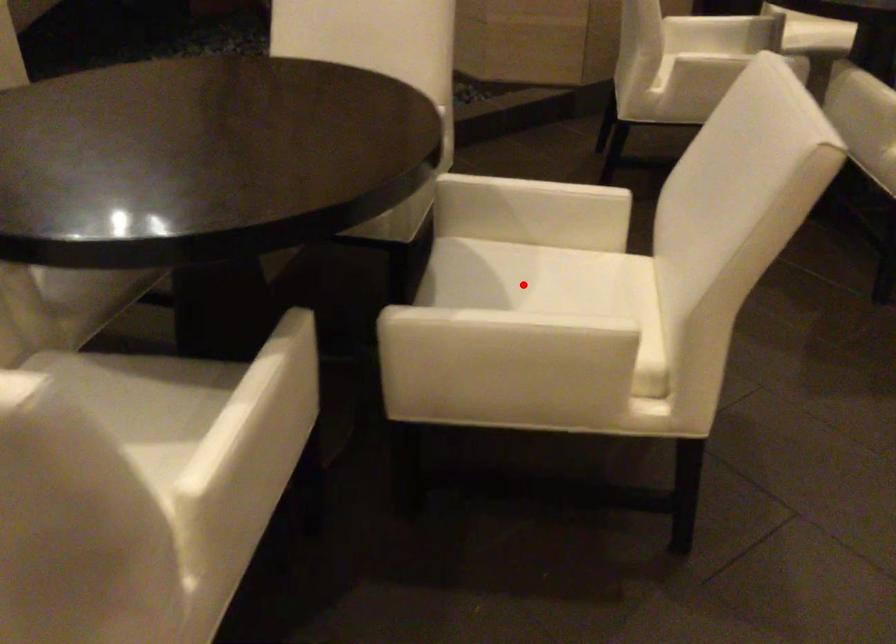
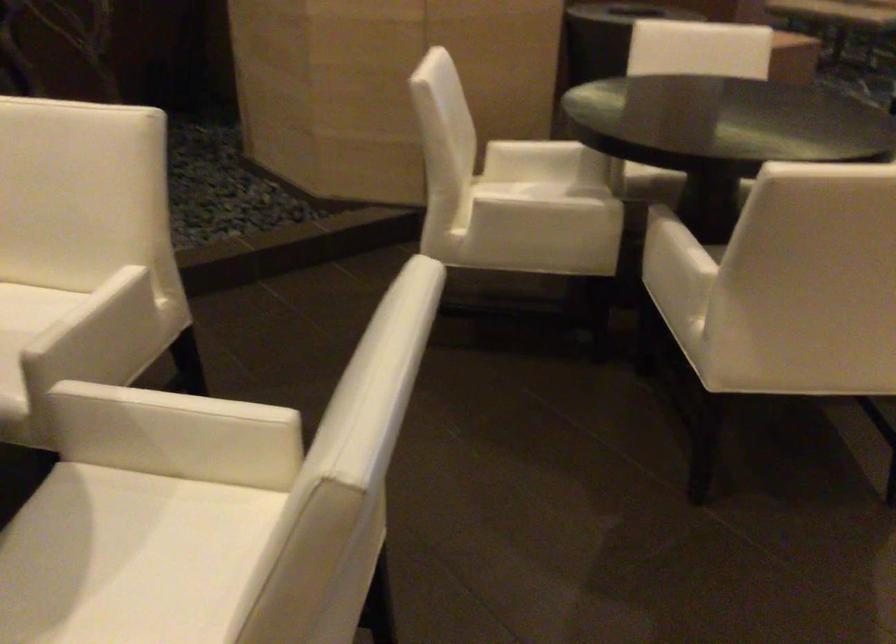
Question: I am providing you with two images of the same scene from different viewpoints. Given a red point in image1, look at the same physical point in image2. Is it:

Choices:
 (A) Closer to the viewpoint
 (B) Farther from the viewpoint

Answer: (A)